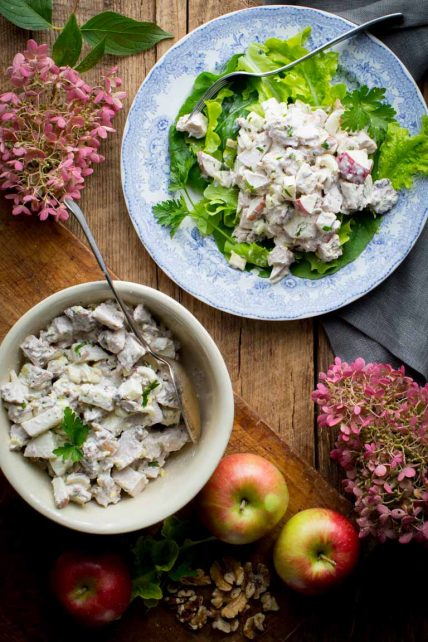
Locate an element on the screen. The width and height of the screenshot is (428, 642). bowl is located at coordinates (217, 449).